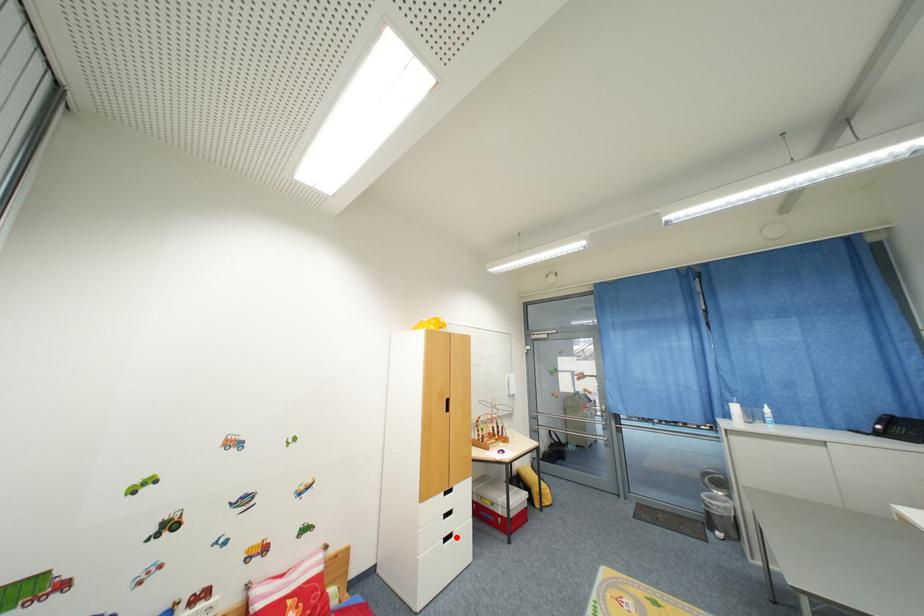
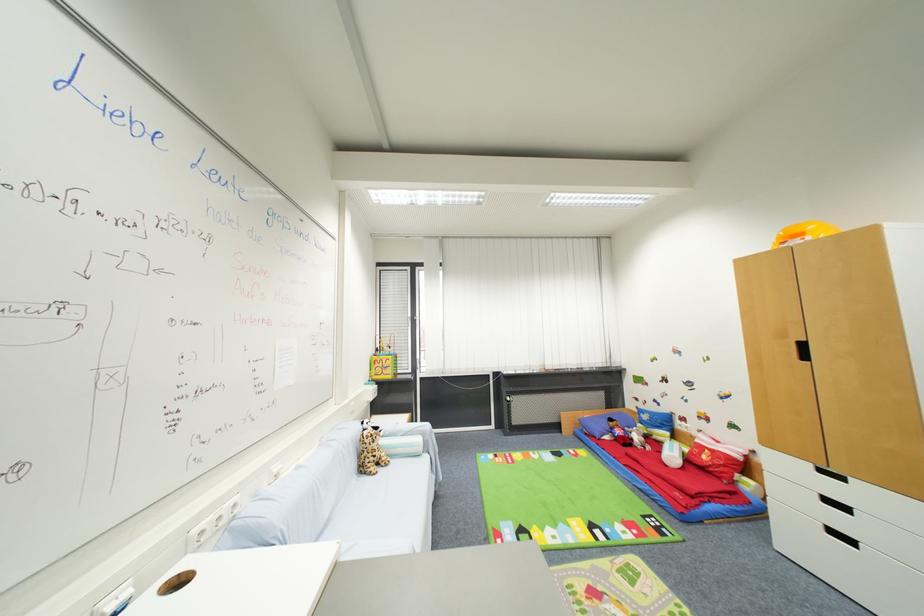
Question: I am providing you with two images of the same scene from different viewpoints. In image1, a red point is highlighted. Considering the same 3D point in image2, which of the following is correct?

Choices:
 (A) It is closer
 (B) It is farther

Answer: (A)